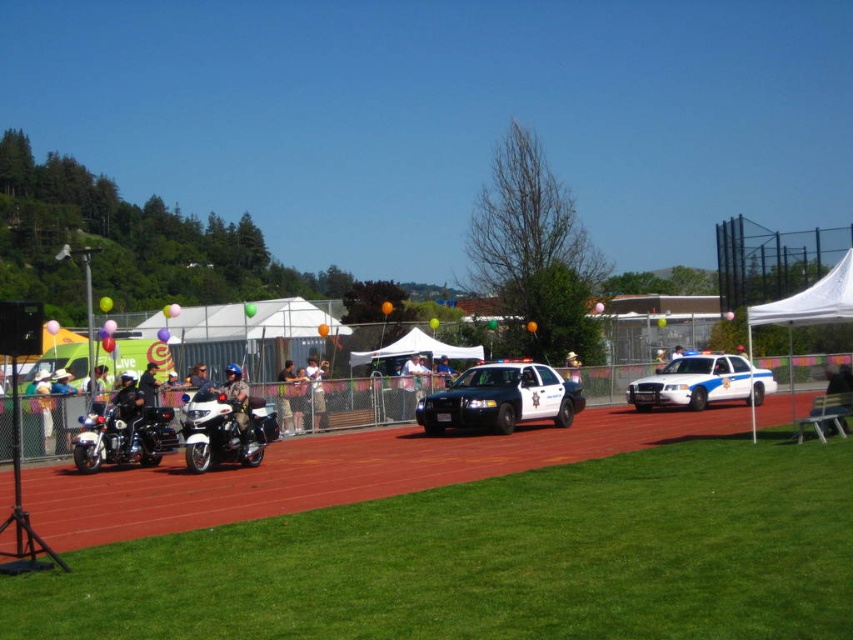
You are a photographer trying to capture both the shiny chrome motorcycle at center and the white glossy police car at right in a single frame. Based on their positions, which vehicle should you focus on first if you want to include both in your photo without moving the camera?

The shiny chrome motorcycle at center is positioned on the left side of the white glossy police car at right, so you should focus on the shiny chrome motorcycle at center first to ensure both vehicles fit in the frame.

You are a photographer standing at the center of the field. You want to take a photo of the brushed metal motorcycle at left. What are the coordinates of the motorcycle relative to your position?

The coordinates of the brushed metal motorcycle at left are at point (126, 410) relative to the image frame. Since you are at the center, the motorcycle is located at 0.641 on the x axis and 0.150 on the y axis from the bottom left corner of the frame.